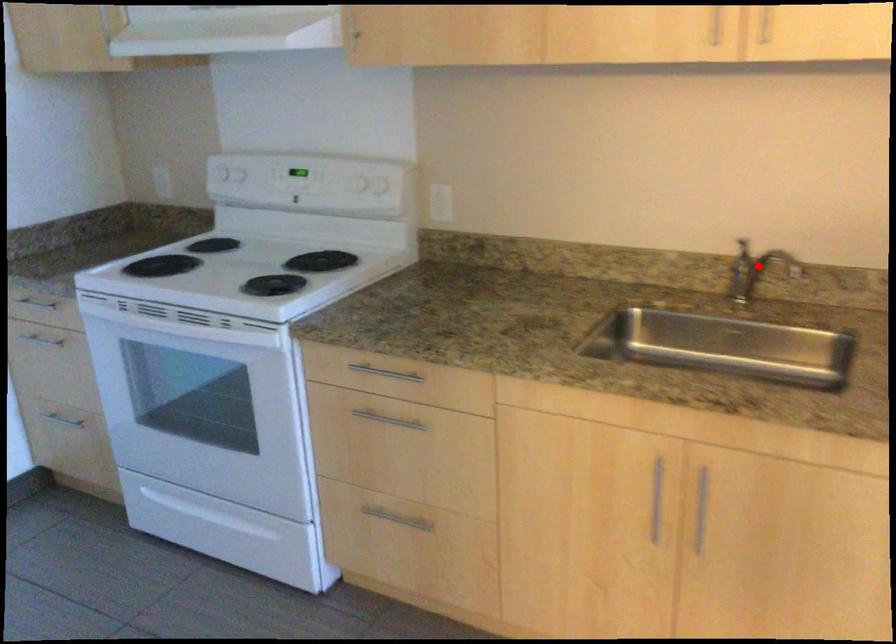
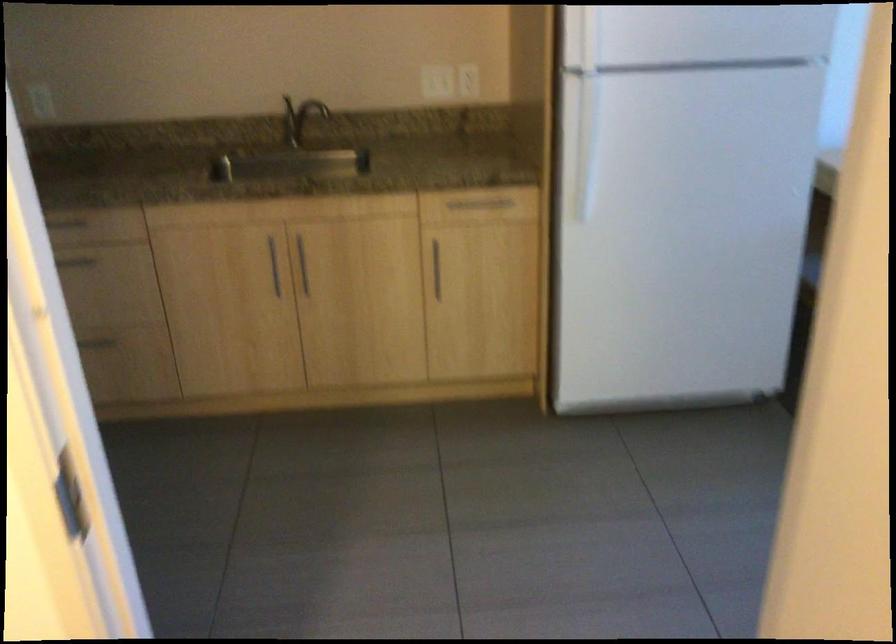
Find the pixel in the second image that matches the highlighted location in the first image.

(299, 118)